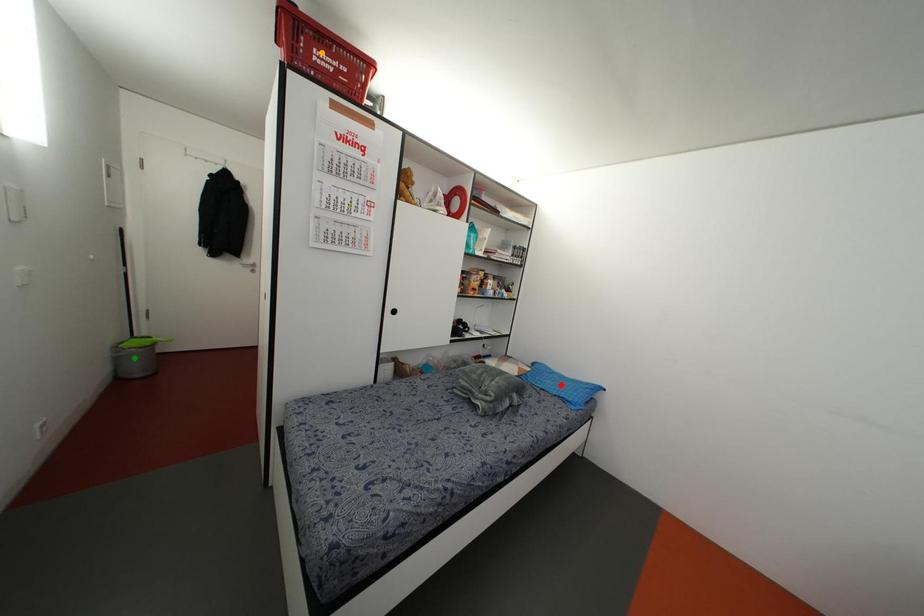
Order these from farthest to nearest:
1. red point
2. orange point
3. green point

1. red point
2. green point
3. orange point